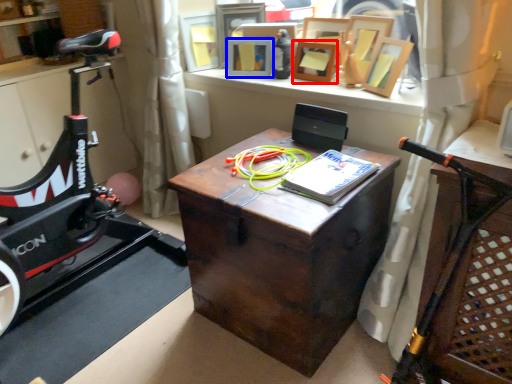
Question: Which point is closer to the camera, picture frame (highlighted by a red box) or picture frame (highlighted by a blue box)?

Choices:
 (A) picture frame
 (B) picture frame

Answer: (A)